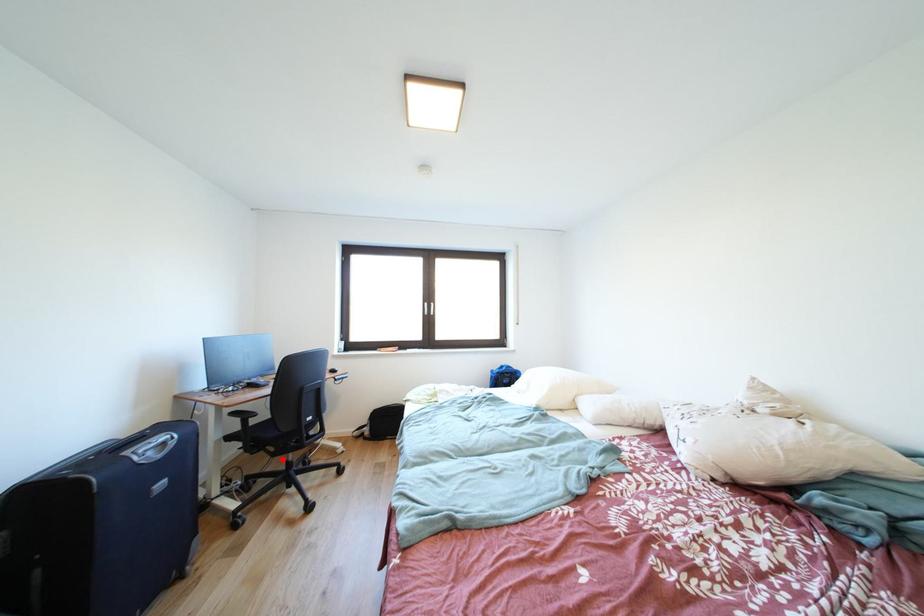
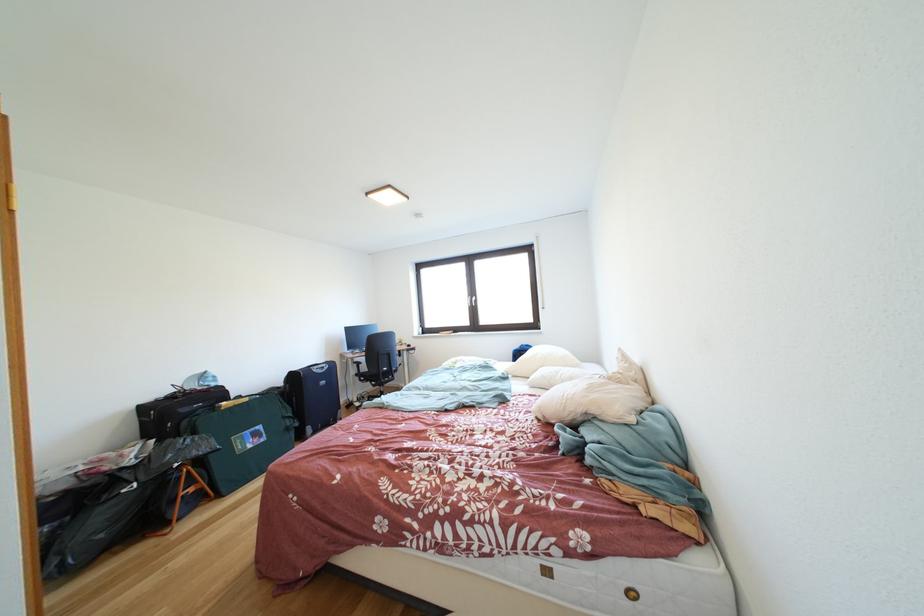
The point at the highlighted location is marked in the first image. Where is the corresponding point in the second image?

(383, 391)